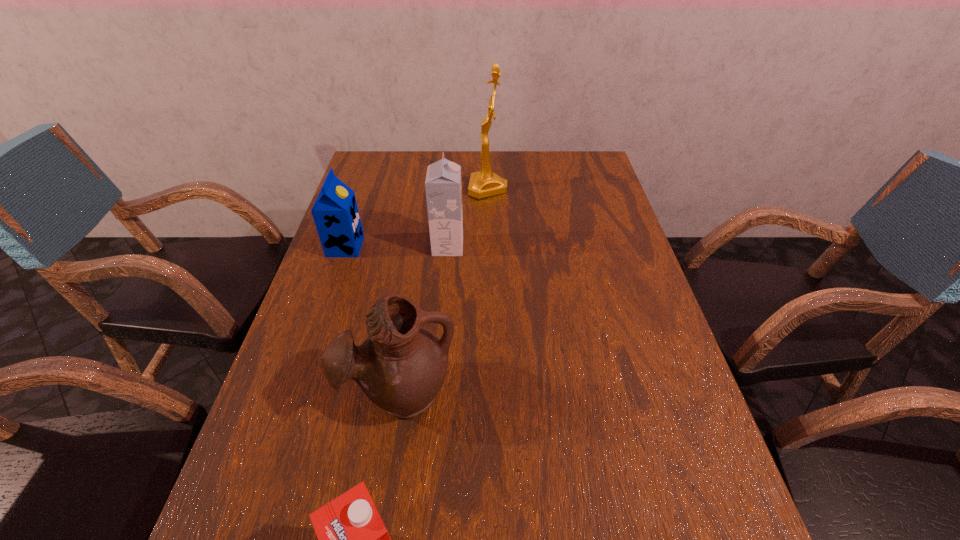
Identify the location of the farthest object. (484, 183).

Locate an element on the screen. The width and height of the screenshot is (960, 540). the rightmost object is located at coordinates (484, 183).

This screenshot has height=540, width=960. In order to click on the tallest carton in this screenshot , I will do `click(443, 187)`.

Identify the location of the fourth farthest object. The image size is (960, 540). (402, 365).

Identify the location of the leftmost carton. (335, 212).

This screenshot has height=540, width=960. What are the coordinates of `vacant area situated 0.110m on the front-facing side of the rightmost object` in the screenshot? It's located at (435, 188).

You are a GUI agent. You are given a task and a screenshot of the screen. Output one action in this format:
    pyautogui.click(x=<x>, y=<y>)
    Task: Click on the vacant area situated on the front-facing side of the rightmost object
    The height and width of the screenshot is (540, 960).
    Given the screenshot: What is the action you would take?
    pyautogui.click(x=398, y=188)

Find the location of a particular element. The height and width of the screenshot is (540, 960). free space located 0.110m on the front-facing side of the rightmost object is located at coordinates (435, 188).

Locate an element on the screen. The width and height of the screenshot is (960, 540). free space located 0.070m on the front label of the tallest carton is located at coordinates (488, 247).

You are a GUI agent. You are given a task and a screenshot of the screen. Output one action in this format:
    pyautogui.click(x=<x>, y=<y>)
    Task: Click on the free space located 0.050m at the spout of the fourth farthest object
    This screenshot has height=540, width=960.
    Given the screenshot: What is the action you would take?
    pyautogui.click(x=391, y=459)